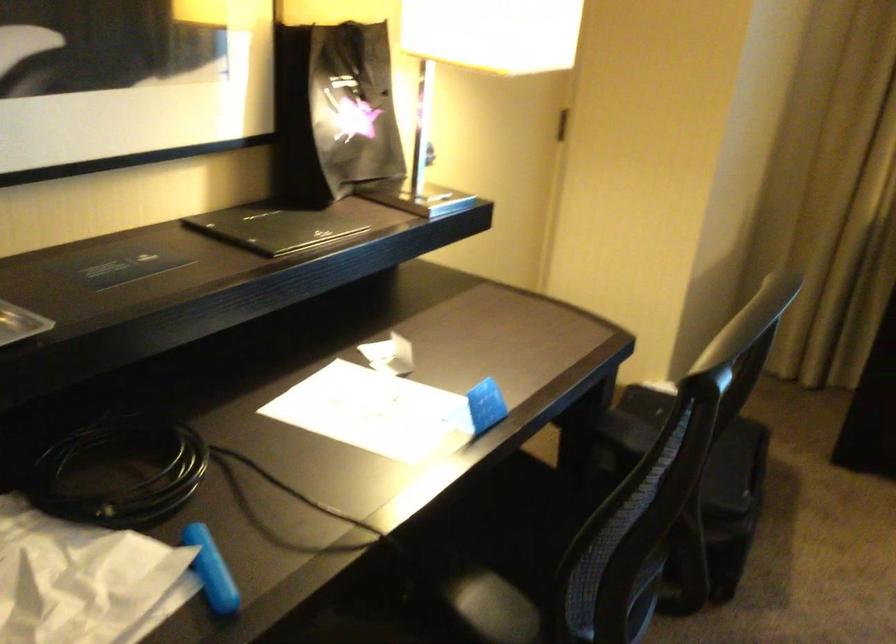
Identify the location of black folder. The height and width of the screenshot is (644, 896). (273, 228).